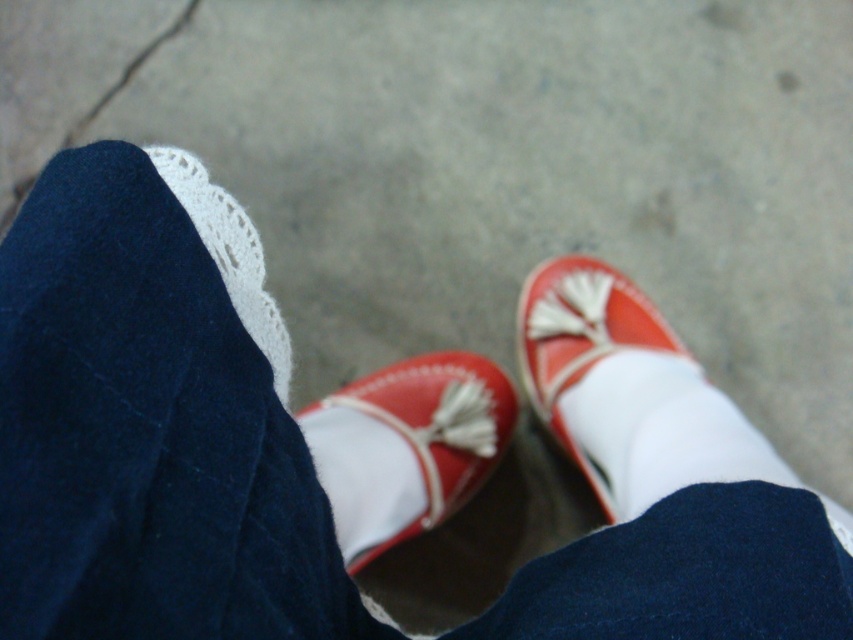
You are a photographer focusing on capturing details of footwear. You notice the red leather shoe at center and the matte leather shoe at lower right in the frame. Which shoe should you adjust your camera to focus on if you want to capture the one that is positioned to the left?

The red leather shoe at center should be focused on because it is positioned to the left of the matte leather shoe at lower right.

You are a photographer trying to capture the red leather shoe at center and the white lace at upper left in a single frame. Based on their positions, which object should you adjust your camera to focus on first if you want to ensure both are in the frame?

The white lace at upper left should be focused on first since the red leather shoe at center is to the right of it, allowing you to adjust the frame to include both objects.

You are taking a photo of the person from the scene and want to focus on the point that is closer to the camera. Which point should you choose between point (479,400) and point (556,307)?

Point (479,400) is closer to the camera than point (556,307), so you should choose point (479,400) to focus on.